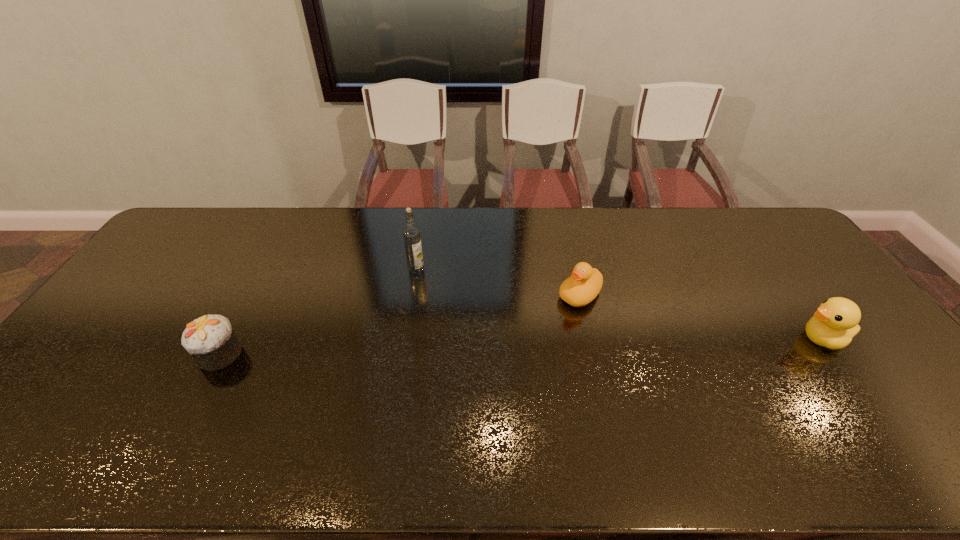
The image size is (960, 540). What are the coordinates of `free location that satisfies the following two spatial constraints: 1. on the front side of the farther duck; 2. on the face of the nearer duck` in the screenshot? It's located at (x=590, y=339).